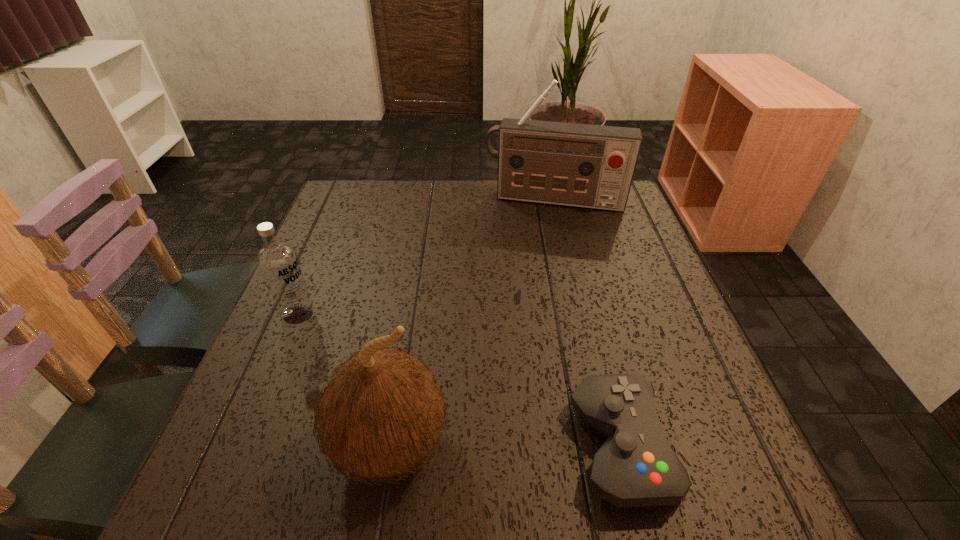
This screenshot has width=960, height=540. Identify the location of free space between the shortest object and the radio receiver. (587, 323).

Identify the location of vacant point located between the shortest object and the leftmost object. (459, 380).

Where is `blank region between the second shortest object and the radio receiver`? The width and height of the screenshot is (960, 540). blank region between the second shortest object and the radio receiver is located at coordinates (426, 257).

Find the location of a particular element. free space between the shortest object and the third shortest object is located at coordinates (505, 446).

The image size is (960, 540). What are the coordinates of `vacant region between the radio receiver and the second object from left to right` in the screenshot? It's located at (472, 322).

Find the location of a particular element. the third closest object relative to the second object from left to right is located at coordinates (591, 166).

Find the location of a particular element. object that stands as the third closest to the second object from left to right is located at coordinates (591, 166).

I want to click on free location that satisfies the following two spatial constraints: 1. on the surface of the second object from left to right; 2. on the right side of the shortest object, so click(x=390, y=447).

Find the location of a particular element. vacant region that satisfies the following two spatial constraints: 1. on the back side of the farthest object; 2. on the right side of the third nearest object is located at coordinates (346, 200).

Locate an element on the screen. The width and height of the screenshot is (960, 540). free location that satisfies the following two spatial constraints: 1. on the surface of the control; 2. on the right side of the third object from right to left is located at coordinates (390, 447).